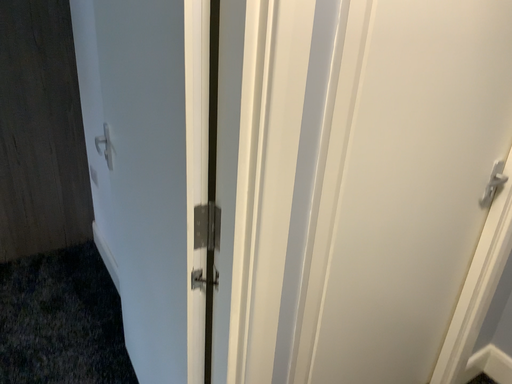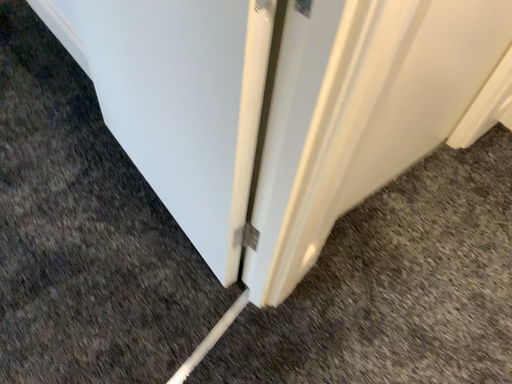
Question: How did the camera likely rotate when shooting the video?

Choices:
 (A) rotated left
 (B) rotated right

Answer: (B)